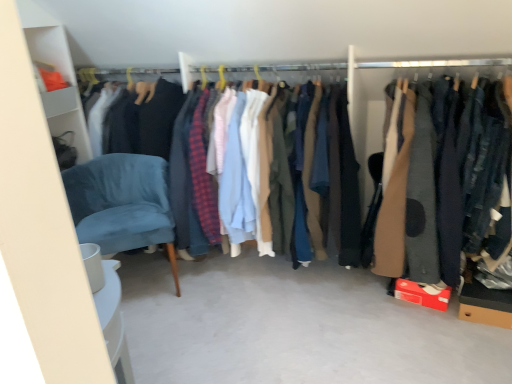
Measure the distance between point (x=141, y=189) and camera.

A distance of 2.26 meters exists between point (x=141, y=189) and camera.

Measure the distance between velvet blue chair at lower left and camera.

velvet blue chair at lower left is 1.95 meters from camera.

Find the location of a particular element. Image resolution: width=512 pixels, height=384 pixels. matte cotton shirts at center, the 2th clothing viewed from the right is located at coordinates (265, 168).

Describe the element at coordinates (265, 168) in the screenshot. The image size is (512, 384). I see `matte cotton shirts at center, which appears as the first clothing when viewed from the left` at that location.

Locate an element on the screen. The width and height of the screenshot is (512, 384). velvet blue chair at lower left is located at coordinates (122, 203).

Considering the relative positions of matte cotton shirts at center, which appears as the first clothing when viewed from the left, and velvet blue chair at lower left in the image provided, is matte cotton shirts at center, which appears as the first clothing when viewed from the left, in front of velvet blue chair at lower left?

Yes, matte cotton shirts at center, which appears as the first clothing when viewed from the left, is closer to the camera.

Can you tell me how much matte cotton shirts at center, which appears as the first clothing when viewed from the left, and velvet blue chair at lower left differ in facing direction?

43.8 degrees.

Looking at this image, from a real-world perspective, is matte cotton shirts at center, which appears as the first clothing when viewed from the left, positioned above or below velvet blue chair at lower left?

matte cotton shirts at center, which appears as the first clothing when viewed from the left, is above velvet blue chair at lower left.

Identify the location of the 1st clothing in front of the velvet blue chair at lower left, counting from the anchor's position. (265, 168).

Based on the photo, between brown wool coat at right, acting as the first clothing starting from the right, and matte cotton shirts at center, which appears as the first clothing when viewed from the left, which one has less height?

With less height is brown wool coat at right, acting as the first clothing starting from the right.

Between brown wool coat at right, arranged as the second clothing when viewed from the left, and matte cotton shirts at center, the 2th clothing viewed from the right, which one has larger size?

Bigger between the two is matte cotton shirts at center, the 2th clothing viewed from the right.

Find the location of a particular element. clothing above the matte cotton shirts at center, which appears as the first clothing when viewed from the left (from the image's perspective) is located at coordinates (423, 190).

Looking at their sizes, would you say brown wool coat at right, acting as the first clothing starting from the right, is wider or thinner than matte cotton shirts at center, the 2th clothing viewed from the right?

In the image, brown wool coat at right, acting as the first clothing starting from the right, appears to be wider than matte cotton shirts at center, the 2th clothing viewed from the right.

Which of these two, velvet blue chair at lower left or brown wool coat at right, acting as the first clothing starting from the right, is smaller?

Smaller between the two is velvet blue chair at lower left.

From a real-world perspective, is velvet blue chair at lower left located beneath brown wool coat at right, acting as the first clothing starting from the right?

Yes, from a real-world perspective, velvet blue chair at lower left is under brown wool coat at right, acting as the first clothing starting from the right.

Does velvet blue chair at lower left contain brown wool coat at right, acting as the first clothing starting from the right?

Actually, brown wool coat at right, acting as the first clothing starting from the right, is outside velvet blue chair at lower left.

Is velvet blue chair at lower left thinner than brown wool coat at right, arranged as the second clothing when viewed from the left?

Yes, velvet blue chair at lower left is thinner than brown wool coat at right, arranged as the second clothing when viewed from the left.

Is matte cotton shirts at center, which appears as the first clothing when viewed from the left, further to camera compared to brown wool coat at right, acting as the first clothing starting from the right?

Yes, the depth of matte cotton shirts at center, which appears as the first clothing when viewed from the left, is greater than that of brown wool coat at right, acting as the first clothing starting from the right.

Does matte cotton shirts at center, which appears as the first clothing when viewed from the left, have a lesser width compared to brown wool coat at right, arranged as the second clothing when viewed from the left?

Indeed, matte cotton shirts at center, which appears as the first clothing when viewed from the left, has a lesser width compared to brown wool coat at right, arranged as the second clothing when viewed from the left.

Is point (252, 236) closer to camera compared to point (389, 222)?

No, it is not.

Does matte cotton shirts at center, the 2th clothing viewed from the right, have a larger size compared to brown wool coat at right, arranged as the second clothing when viewed from the left?

Indeed, matte cotton shirts at center, the 2th clothing viewed from the right, has a larger size compared to brown wool coat at right, arranged as the second clothing when viewed from the left.

From a real-world perspective, is brown wool coat at right, arranged as the second clothing when viewed from the left, physically above velvet blue chair at lower left?

Yes, from a real-world perspective, brown wool coat at right, arranged as the second clothing when viewed from the left, is over velvet blue chair at lower left

Considering the relative sizes of brown wool coat at right, arranged as the second clothing when viewed from the left, and velvet blue chair at lower left in the image provided, is brown wool coat at right, arranged as the second clothing when viewed from the left, thinner than velvet blue chair at lower left?

No.

Is brown wool coat at right, arranged as the second clothing when viewed from the left, positioned far away from velvet blue chair at lower left?

Indeed, brown wool coat at right, arranged as the second clothing when viewed from the left, is not near velvet blue chair at lower left.

Considering the positions of objects brown wool coat at right, acting as the first clothing starting from the right, and velvet blue chair at lower left in the image provided, who is more to the right, brown wool coat at right, acting as the first clothing starting from the right, or velvet blue chair at lower left?

brown wool coat at right, acting as the first clothing starting from the right, is more to the right.

Is velvet blue chair at lower left facing towards matte cotton shirts at center, the 2th clothing viewed from the right?

No, velvet blue chair at lower left is not aimed at matte cotton shirts at center, the 2th clothing viewed from the right.

Where is `chair that appears on the left of matte cotton shirts at center, the 2th clothing viewed from the right`? chair that appears on the left of matte cotton shirts at center, the 2th clothing viewed from the right is located at coordinates (122, 203).

Looking at the image, does velvet blue chair at lower left seem bigger or smaller compared to matte cotton shirts at center, which appears as the first clothing when viewed from the left?

Clearly, velvet blue chair at lower left is smaller in size than matte cotton shirts at center, which appears as the first clothing when viewed from the left.

From the image's perspective, is velvet blue chair at lower left on top of matte cotton shirts at center, the 2th clothing viewed from the right?

Actually, velvet blue chair at lower left appears below matte cotton shirts at center, the 2th clothing viewed from the right, in the image.

This screenshot has width=512, height=384. Identify the location of chair behind the matte cotton shirts at center, which appears as the first clothing when viewed from the left. (122, 203).

This screenshot has height=384, width=512. In the image, there is a brown wool coat at right, acting as the first clothing starting from the right. Identify the location of clothing below it (from a real-world perspective). pyautogui.click(x=265, y=168).

From the image, which object appears to be nearer to brown wool coat at right, acting as the first clothing starting from the right, velvet blue chair at lower left or matte cotton shirts at center, which appears as the first clothing when viewed from the left?

Among the two, matte cotton shirts at center, which appears as the first clothing when viewed from the left, is located nearer to brown wool coat at right, acting as the first clothing starting from the right.

Considering their positions, is brown wool coat at right, acting as the first clothing starting from the right, positioned closer to matte cotton shirts at center, which appears as the first clothing when viewed from the left, than velvet blue chair at lower left?

The object closer to matte cotton shirts at center, which appears as the first clothing when viewed from the left, is velvet blue chair at lower left.

Considering their positions, is brown wool coat at right, acting as the first clothing starting from the right, positioned closer to velvet blue chair at lower left than matte cotton shirts at center, the 2th clothing viewed from the right?

matte cotton shirts at center, the 2th clothing viewed from the right, is positioned closer to the anchor velvet blue chair at lower left.

Considering their positions, is matte cotton shirts at center, which appears as the first clothing when viewed from the left, positioned closer to velvet blue chair at lower left than brown wool coat at right, acting as the first clothing starting from the right?

matte cotton shirts at center, which appears as the first clothing when viewed from the left, is closer to velvet blue chair at lower left.

When comparing their distances from brown wool coat at right, acting as the first clothing starting from the right, does matte cotton shirts at center, which appears as the first clothing when viewed from the left, or velvet blue chair at lower left seem closer?

matte cotton shirts at center, which appears as the first clothing when viewed from the left.

Estimate the real-world distances between objects in this image. Which object is closer to matte cotton shirts at center, which appears as the first clothing when viewed from the left, velvet blue chair at lower left or brown wool coat at right, arranged as the second clothing when viewed from the left?

Among the two, velvet blue chair at lower left is located nearer to matte cotton shirts at center, which appears as the first clothing when viewed from the left.

The height and width of the screenshot is (384, 512). I want to click on clothing situated between velvet blue chair at lower left and brown wool coat at right, arranged as the second clothing when viewed from the left, from left to right, so click(x=265, y=168).